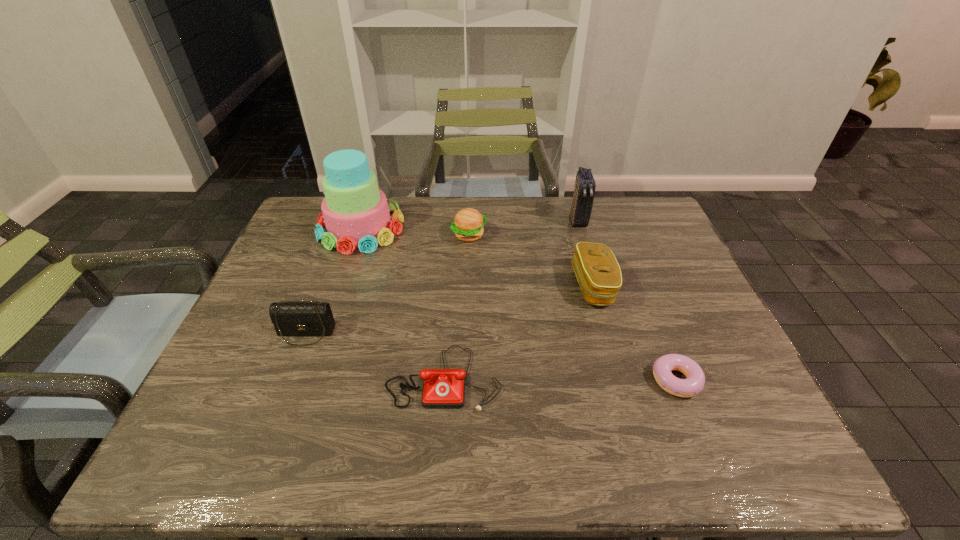
This screenshot has width=960, height=540. I want to click on clutch bag situated at the far edge, so click(x=582, y=203).

This screenshot has height=540, width=960. What are the coordinates of `hamburger that is positioned at the far edge` in the screenshot? It's located at (468, 224).

Find the location of a particular element. cake at the left edge is located at coordinates (355, 212).

I want to click on clutch bag that is at the left edge, so tap(290, 318).

This screenshot has height=540, width=960. What are the coordinates of `object present at the right edge` in the screenshot? It's located at click(662, 367).

This screenshot has width=960, height=540. Identify the location of object located in the far left corner section of the desktop. (355, 212).

In the image, there is a desktop. In order to click on vacant space at the far edge in this screenshot , I will do `click(533, 216)`.

Where is `vacant space at the near edge of the desktop`? This screenshot has width=960, height=540. vacant space at the near edge of the desktop is located at coordinates (396, 452).

This screenshot has height=540, width=960. In the image, there is a desktop. Identify the location of blank space at the left edge. (273, 283).

This screenshot has width=960, height=540. In order to click on free space at the right edge in this screenshot , I will do point(718,378).